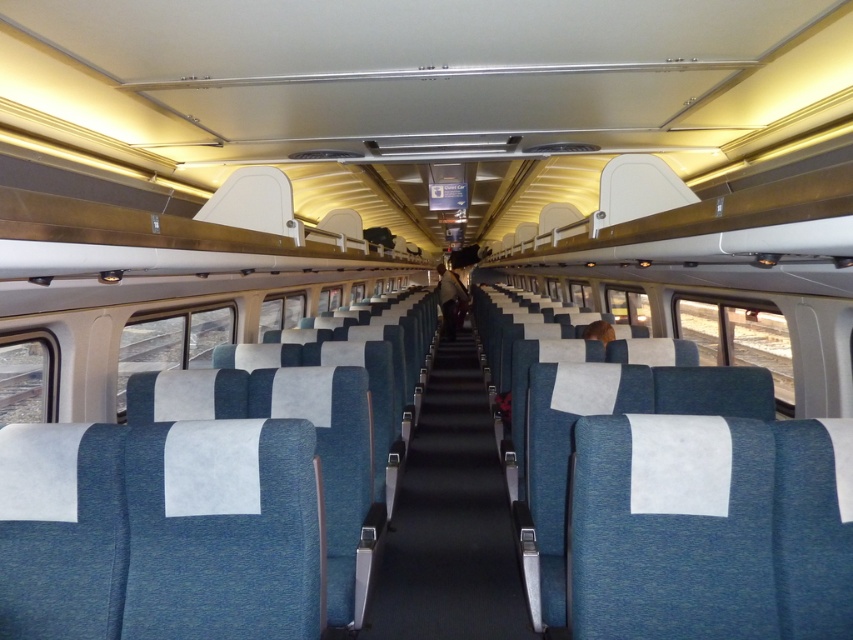
Question: In this image, where is blue fabric aisle at center located relative to blue fabric coach at center?

Choices:
 (A) right
 (B) left

Answer: (B)

Question: Among these points, which one is farthest from the camera?

Choices:
 (A) (442, 266)
 (B) (456, 388)

Answer: (A)

Question: Can you confirm if blue fabric aisle at center is positioned above blue fabric coach at center?

Choices:
 (A) no
 (B) yes

Answer: (A)

Question: Which of the following is the farthest from the observer?

Choices:
 (A) blue fabric aisle at center
 (B) blue fabric coach at center

Answer: (B)

Question: Does blue fabric aisle at center lie behind blue fabric coach at center?

Choices:
 (A) yes
 (B) no

Answer: (B)